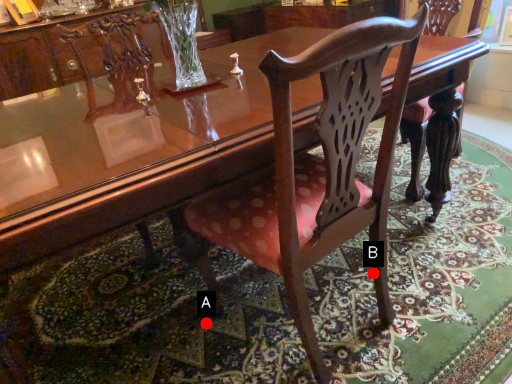
Question: Two points are circled on the image, labeled by A and B beside each circle. Which point is further to the camera?

Choices:
 (A) A is further
 (B) B is further

Answer: (A)